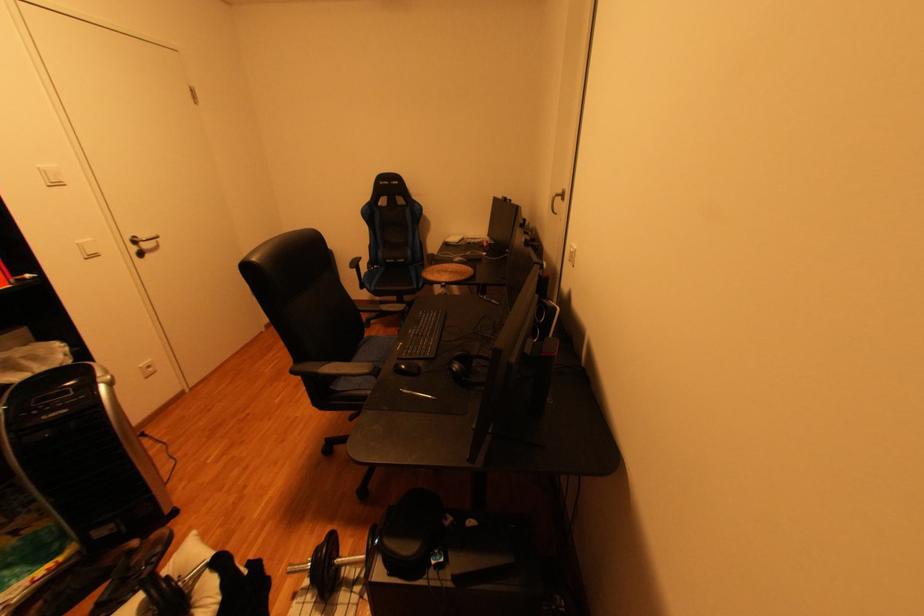
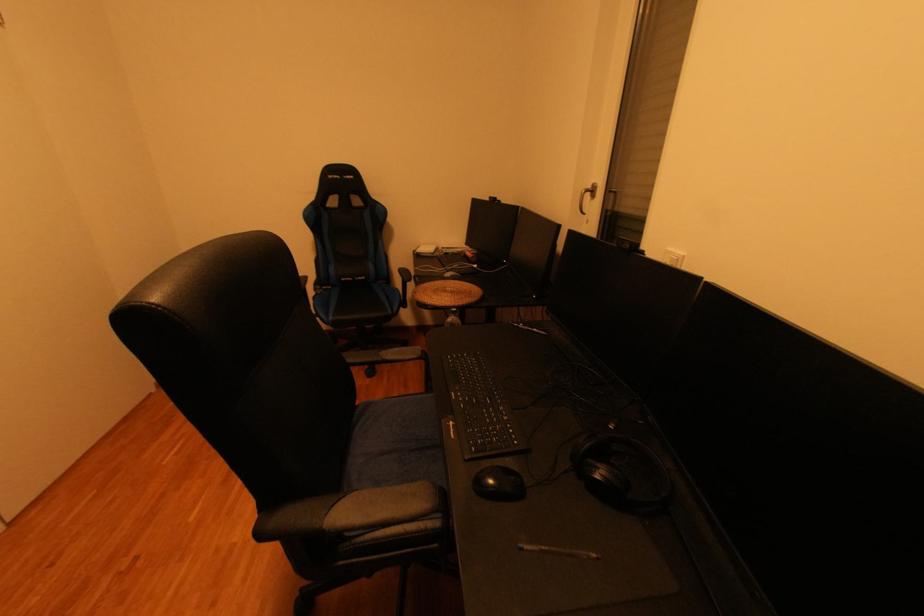
Question: How did the camera likely rotate?

Choices:
 (A) Left
 (B) Right
 (C) Up
 (D) Down

Answer: (B)